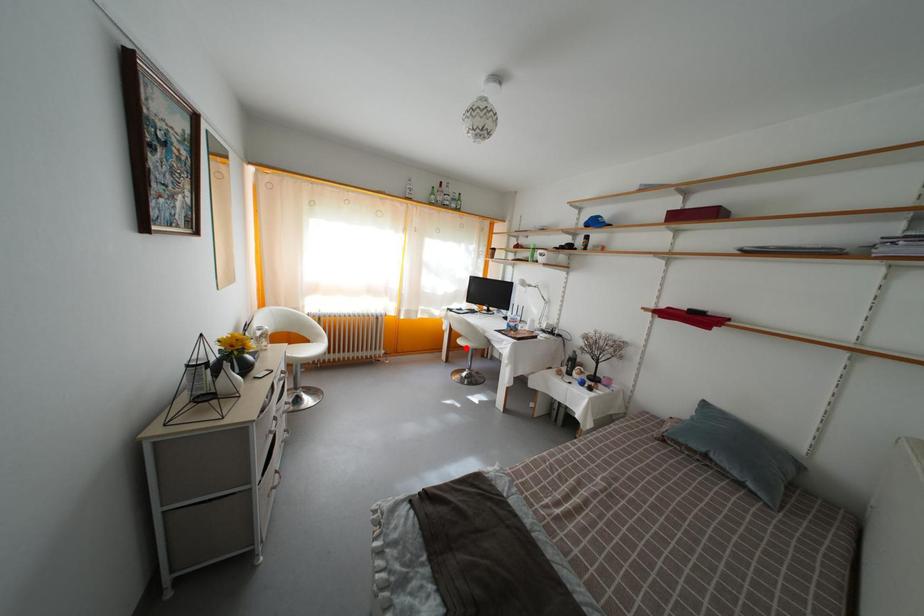
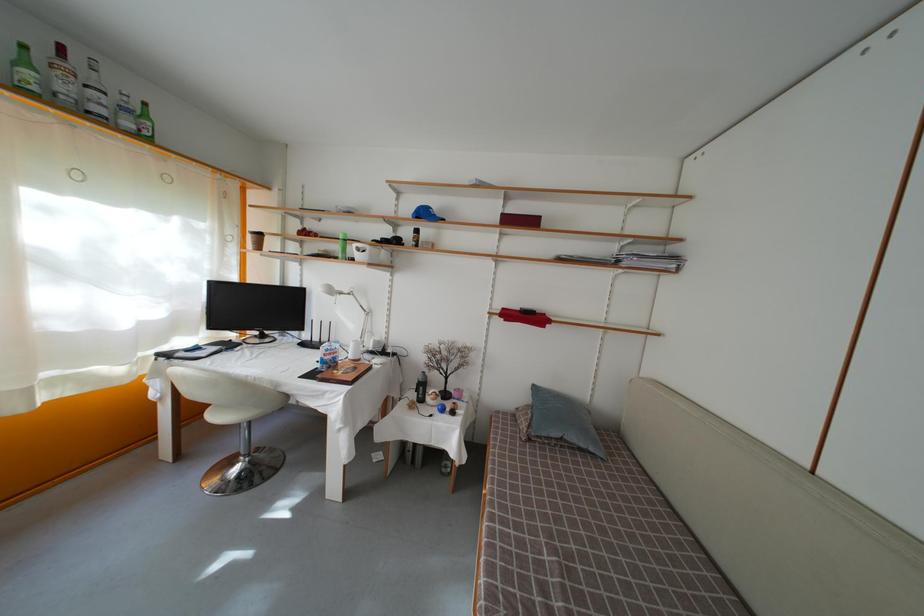
Question: I am providing you with two images of the same scene from different viewpoints. A red point is shown in image1. For the corresponding object point in image2, is it positioned nearer or farther from the camera?

Choices:
 (A) Nearer
 (B) Farther

Answer: (A)